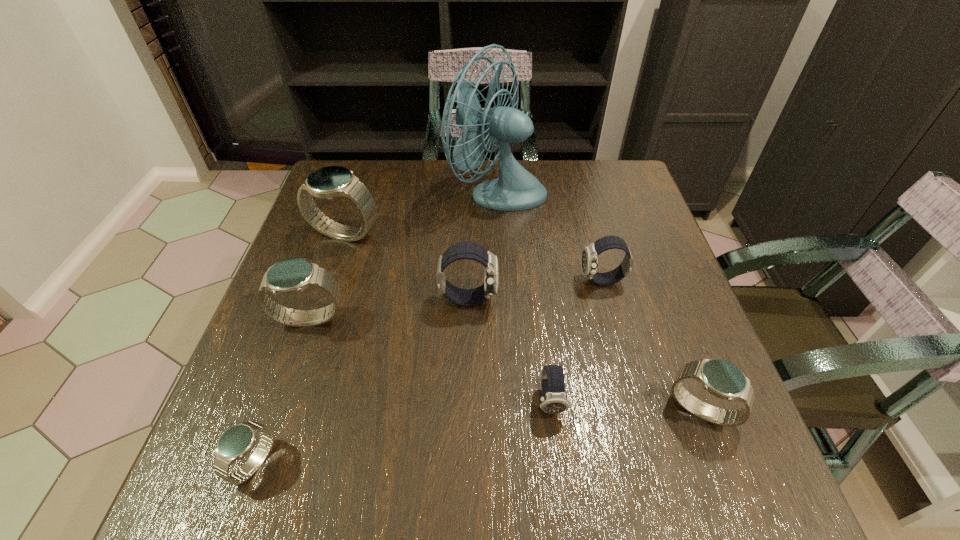
What are the coordinates of `free location at the left edge of the desktop` in the screenshot? It's located at (310, 436).

In the image, there is a desktop. What are the coordinates of `vacant space at the right edge` in the screenshot? It's located at 660,329.

At what (x,y) coordinates should I click in order to perform the action: click on blank space at the far left corner. Please return your answer as a coordinate pair (x, y). The image size is (960, 540). Looking at the image, I should click on (367, 177).

Find the location of a particular element. free space at the near left corner of the desktop is located at coordinates (273, 481).

The image size is (960, 540). Find the location of `vacant space at the near right corner of the desktop`. vacant space at the near right corner of the desktop is located at coordinates (693, 495).

At what (x,y) coordinates should I click in order to perform the action: click on vacant space that is in between the leftmost dark watch and the farthest blue watch. Please return your answer as a coordinate pair (x, y). Image resolution: width=960 pixels, height=540 pixels. Looking at the image, I should click on (407, 266).

Locate an element on the screen. The width and height of the screenshot is (960, 540). free spot between the tallest object and the farthest watch is located at coordinates (421, 212).

Locate an element on the screen. The width and height of the screenshot is (960, 540). vacant space that's between the second farthest blue watch and the leftmost dark watch is located at coordinates (389, 309).

Locate an element on the screen. This screenshot has height=540, width=960. vacant space that is in between the fifth watch from left to right and the second watch from right to left is located at coordinates (576, 341).

The image size is (960, 540). What are the coordinates of `free space between the tallest object and the third watch from right to left` in the screenshot? It's located at (524, 296).